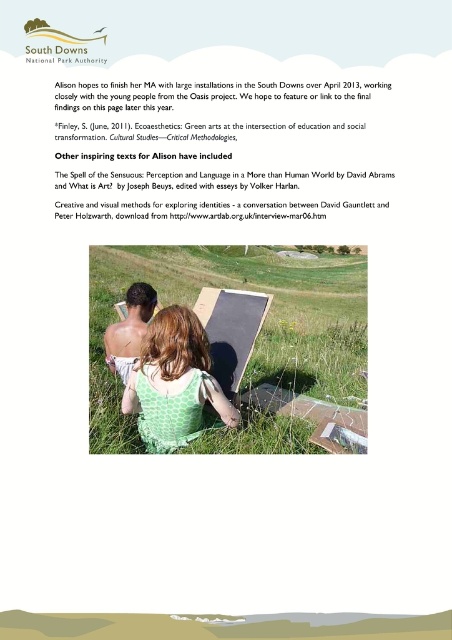
Question: Estimate the real-world distances between objects in this image. Which object is closer to the green dotted dress at center?

Choices:
 (A) white paper at upper center
 (B) green grass at center

Answer: (A)

Question: Which of the following is the farthest from the observer?

Choices:
 (A) (108, 285)
 (B) (132, 330)
 (C) (182, 420)
 (D) (112, 92)

Answer: (A)

Question: Observing the image, what is the correct spatial positioning of green grass at center in reference to shiny metallic book at center?

Choices:
 (A) above
 (B) below

Answer: (A)

Question: Is green grass at center wider than white paper at upper center?

Choices:
 (A) yes
 (B) no

Answer: (A)

Question: Does green dotted dress at center have a smaller size compared to shiny metallic book at center?

Choices:
 (A) no
 (B) yes

Answer: (A)

Question: Which object appears closest to the camera in this image?

Choices:
 (A) white paper at upper center
 (B) shiny metallic book at center

Answer: (A)